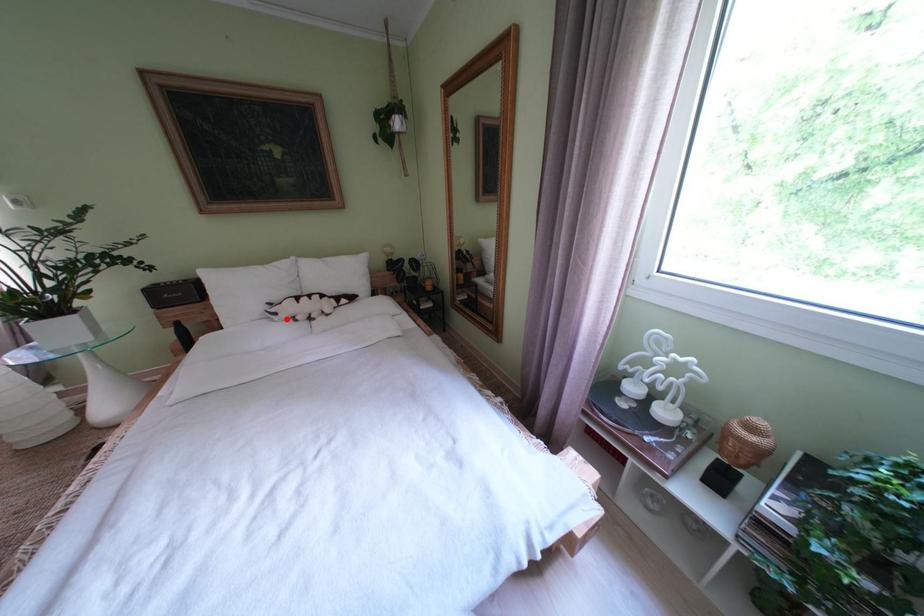
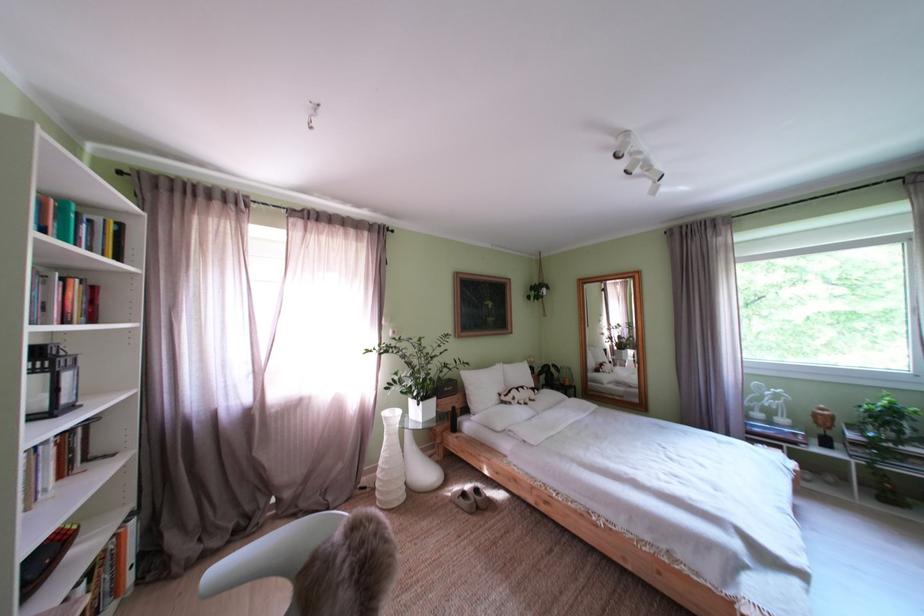
Question: I am providing you with two images of the same scene from different viewpoints. Image1 has a red point marked. In image2, the corresponding 3D location appears at what relative position? Reply with the corresponding letter.

Choices:
 (A) Closer
 (B) Farther

Answer: (B)